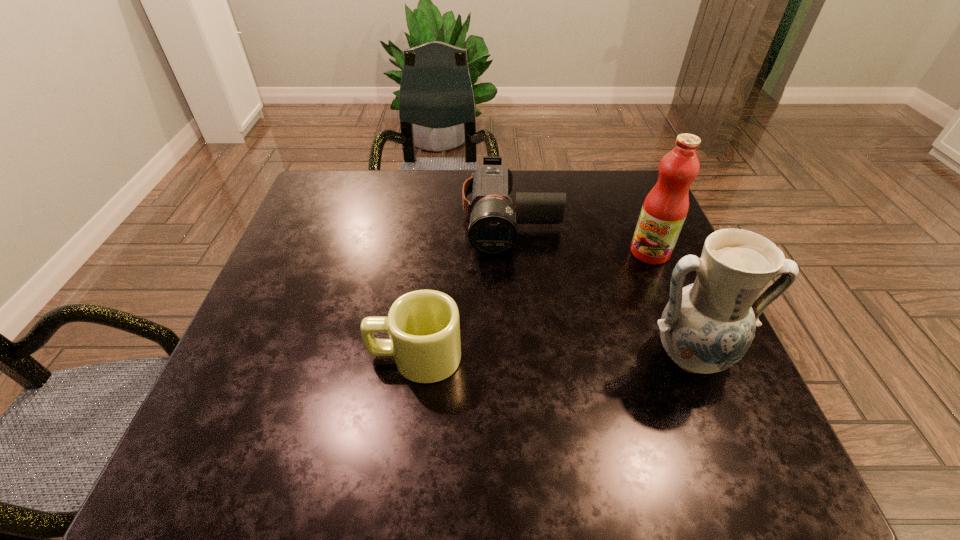
The width and height of the screenshot is (960, 540). Identify the location of free point at the near edge. (423, 390).

Identify the location of free space at the right edge. Image resolution: width=960 pixels, height=540 pixels. (622, 266).

In the image, there is a desktop. Identify the location of vacant space at the near right corner. (708, 376).

Where is `free spot between the camcorder and the pottery`? The height and width of the screenshot is (540, 960). free spot between the camcorder and the pottery is located at coordinates (600, 287).

At what (x,y) coordinates should I click in order to perform the action: click on empty space that is in between the mug and the fruit juice. Please return your answer as a coordinate pair (x, y). Looking at the image, I should click on (533, 305).

Find the location of a particular element. The height and width of the screenshot is (540, 960). vacant space that is in between the pottery and the mug is located at coordinates (552, 356).

The image size is (960, 540). Find the location of `vacant region between the camcorder and the pottery`. vacant region between the camcorder and the pottery is located at coordinates (600, 287).

Locate an element on the screen. The height and width of the screenshot is (540, 960). free spot between the mug and the pottery is located at coordinates (552, 356).

The height and width of the screenshot is (540, 960). I want to click on free space that is in between the camcorder and the mug, so click(x=463, y=287).

Find the location of a particular element. This screenshot has height=540, width=960. unoccupied position between the fruit juice and the mug is located at coordinates (533, 305).